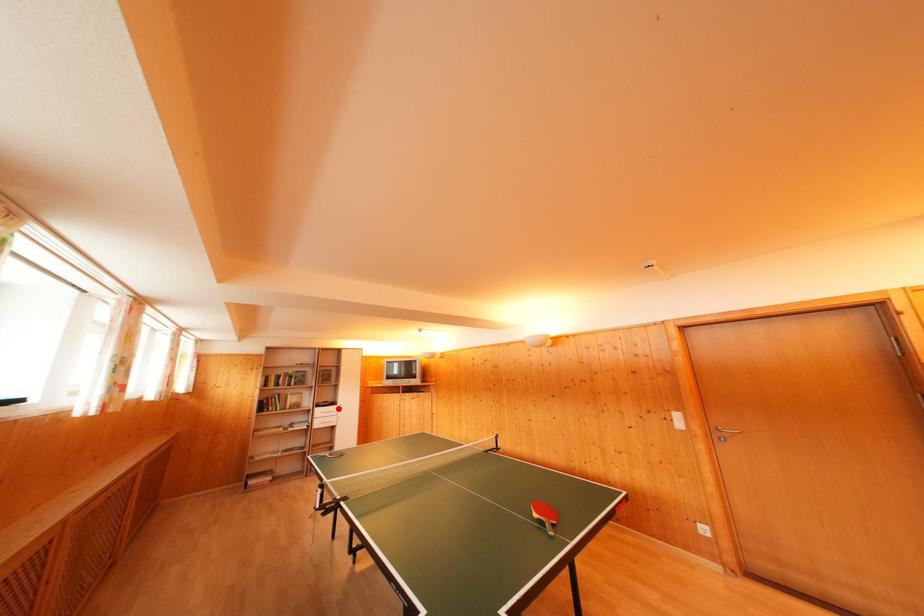
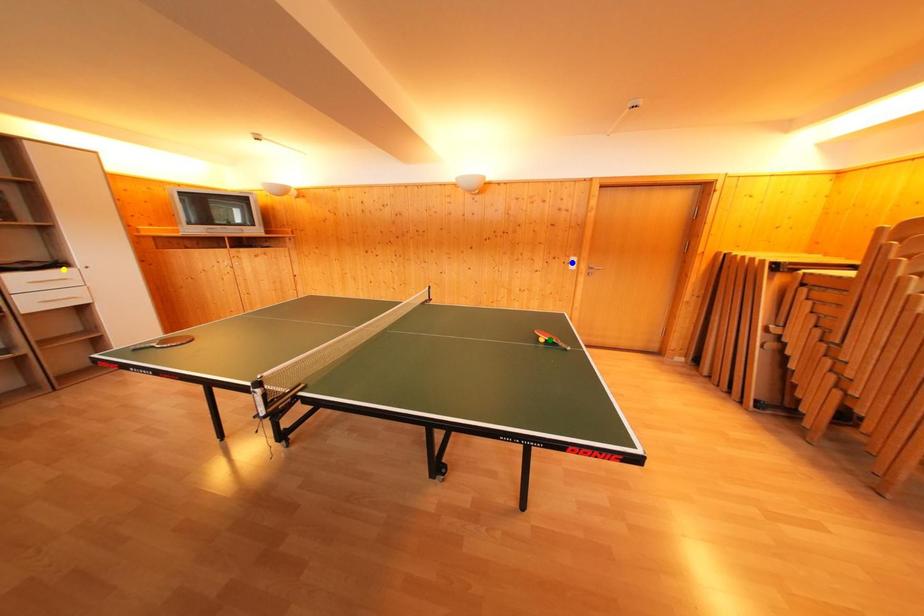
Question: I am providing you with two images of the same scene from different viewpoints. A red point is marked on the first image. You are given multiple points on the second image. Which mark in image 2 goes with the point in image 1?

Choices:
 (A) yellow point
 (B) green point
 (C) blue point

Answer: (A)